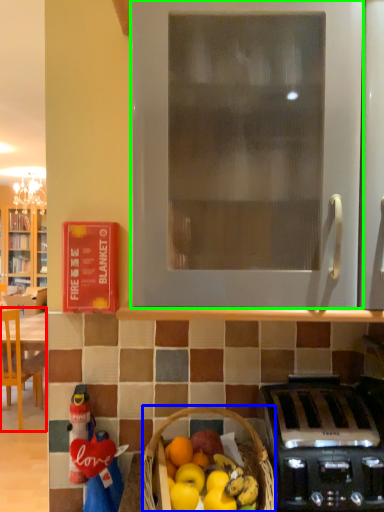
Question: Which is nearer to the chair (highlighted by a red box)? picnic basket (highlighted by a blue box) or oven (highlighted by a green box).

Choices:
 (A) picnic basket
 (B) oven

Answer: (A)